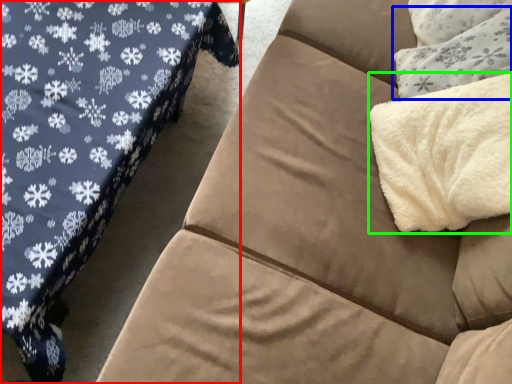
Question: Estimate the real-world distances between objects in this image. Which object is farther from studio couch (highlighted by a red box), throw pillow (highlighted by a blue box) or blanket (highlighted by a green box)?

Choices:
 (A) throw pillow
 (B) blanket

Answer: (A)